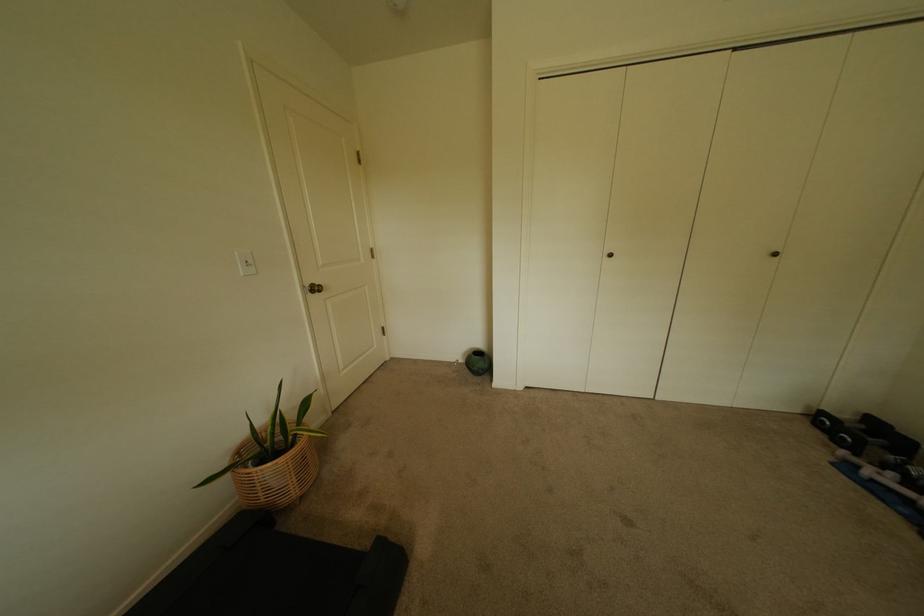
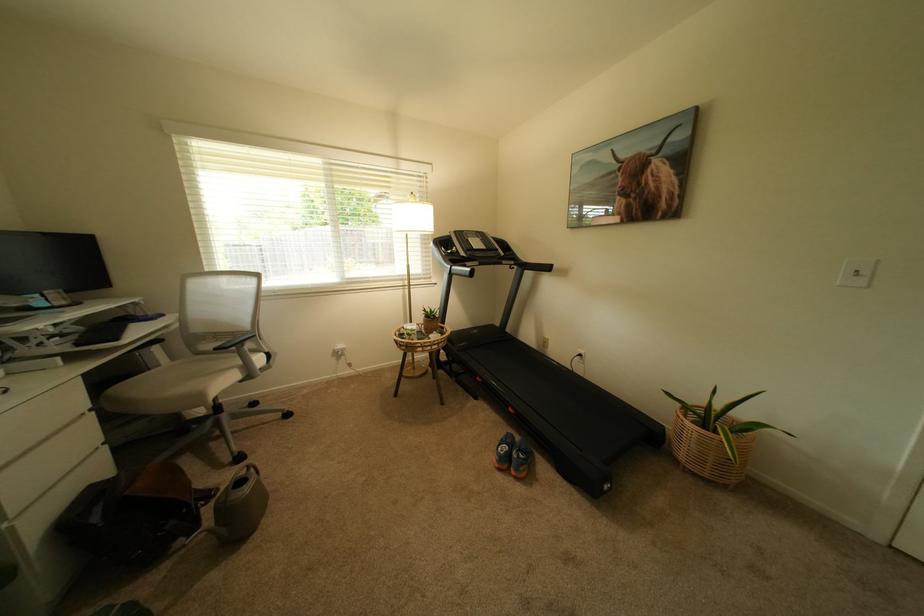
The point at (302, 480) is marked in the first image. Where is the corresponding point in the second image?

(695, 448)